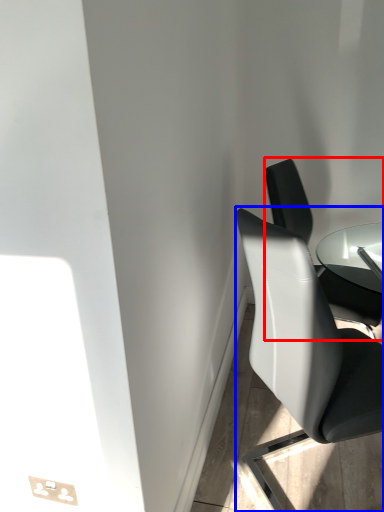
Question: Which of the following is the closest to the observer, chair (highlighted by a red box) or chair (highlighted by a blue box)?

Choices:
 (A) chair
 (B) chair

Answer: (B)